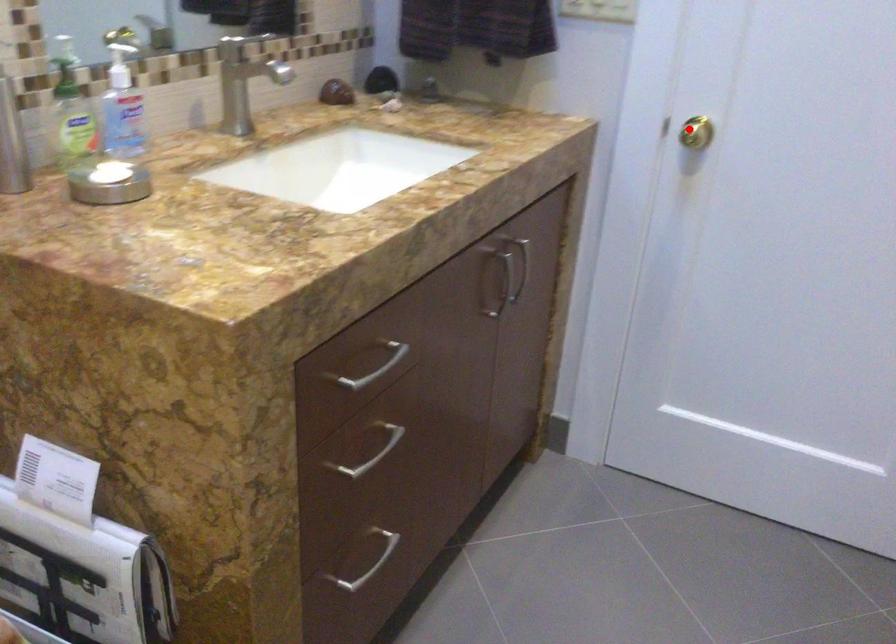
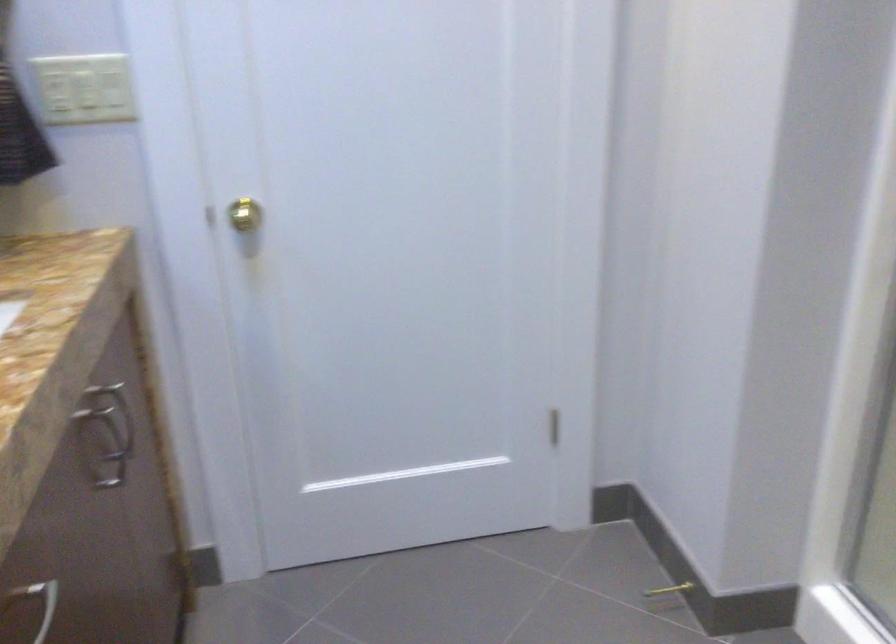
The point at the highlighted location is marked in the first image. Where is the corresponding point in the second image?

(240, 214)